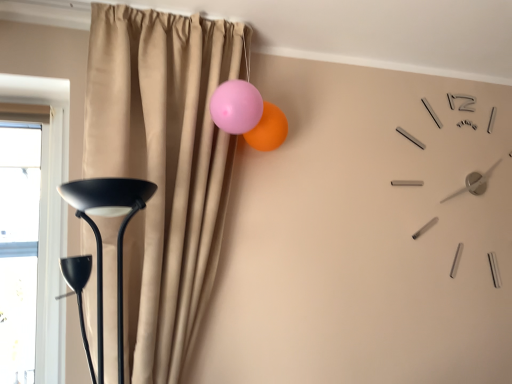
Question: Are beige curtain at upper center and pink glossy balloon at upper center beside each other?

Choices:
 (A) no
 (B) yes

Answer: (A)

Question: From the image's perspective, is beige curtain at upper center above pink glossy balloon at upper center?

Choices:
 (A) no
 (B) yes

Answer: (A)

Question: Is pink glossy balloon at upper center inside beige curtain at upper center?

Choices:
 (A) yes
 (B) no

Answer: (A)

Question: From a real-world perspective, is beige curtain at upper center under pink glossy balloon at upper center?

Choices:
 (A) no
 (B) yes

Answer: (B)

Question: From the image's perspective, is beige curtain at upper center beneath pink glossy balloon at upper center?

Choices:
 (A) yes
 (B) no

Answer: (A)

Question: Is beige curtain at upper center not inside pink glossy balloon at upper center?

Choices:
 (A) yes
 (B) no

Answer: (A)

Question: Is pink glossy balloon at upper center facing towards beige curtain at upper center?

Choices:
 (A) yes
 (B) no

Answer: (A)

Question: From a real-world perspective, is pink glossy balloon at upper center physically below beige curtain at upper center?

Choices:
 (A) no
 (B) yes

Answer: (A)

Question: Does pink glossy balloon at upper center have a smaller size compared to beige curtain at upper center?

Choices:
 (A) no
 (B) yes

Answer: (B)

Question: Does pink glossy balloon at upper center have a lesser width compared to beige curtain at upper center?

Choices:
 (A) yes
 (B) no

Answer: (A)

Question: Is pink glossy balloon at upper center taller than beige curtain at upper center?

Choices:
 (A) no
 (B) yes

Answer: (A)

Question: From the image's perspective, does pink glossy balloon at upper center appear lower than beige curtain at upper center?

Choices:
 (A) yes
 (B) no

Answer: (B)

Question: Is transparent glass window at left not close to pink glossy balloon at upper center?

Choices:
 (A) no
 (B) yes

Answer: (A)